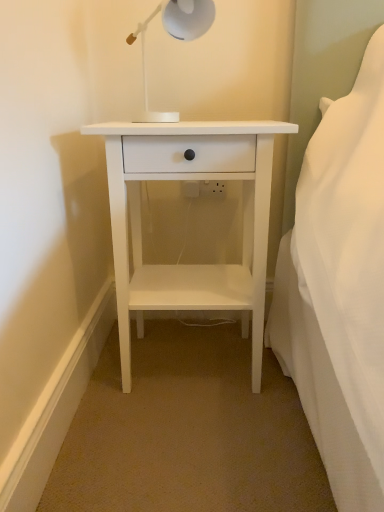
The height and width of the screenshot is (512, 384). What are the coordinates of `white matte nightstand at center` in the screenshot? It's located at (190, 182).

Describe the element at coordinates (190, 182) in the screenshot. The width and height of the screenshot is (384, 512). I see `white matte nightstand at center` at that location.

Measure the distance between white plastic lamp at upper center and camera.

white plastic lamp at upper center is 38.52 inches from camera.

Image resolution: width=384 pixels, height=512 pixels. Describe the element at coordinates (175, 38) in the screenshot. I see `white plastic lamp at upper center` at that location.

The image size is (384, 512). What are the coordinates of `white plastic lamp at upper center` in the screenshot? It's located at (175, 38).

The width and height of the screenshot is (384, 512). In order to click on white matte nightstand at center in this screenshot , I will do `click(190, 182)`.

Is white plastic lamp at upper center to the left of white matte nightstand at center from the viewer's perspective?

Correct, you'll find white plastic lamp at upper center to the left of white matte nightstand at center.

Which is behind, white plastic lamp at upper center or white matte nightstand at center?

white matte nightstand at center is behind.

Does point (176, 119) come in front of point (189, 129)?

That is False.

From the image's perspective, which is below, white plastic lamp at upper center or white matte nightstand at center?

white matte nightstand at center appears lower in the image.

From a real-world perspective, which is physically below, white plastic lamp at upper center or white matte nightstand at center?

white matte nightstand at center is physically lower.

From the picture: Looking at their sizes, would you say white plastic lamp at upper center is wider or thinner than white matte nightstand at center?

Clearly, white plastic lamp at upper center has less width compared to white matte nightstand at center.

Who is shorter, white plastic lamp at upper center or white matte nightstand at center?

Standing shorter between the two is white plastic lamp at upper center.

Looking at this image, who is bigger, white plastic lamp at upper center or white matte nightstand at center?

white matte nightstand at center is bigger.

Is white matte nightstand at center inside white plastic lamp at upper center?

No, white matte nightstand at center is not surrounded by white plastic lamp at upper center.

Are white plastic lamp at upper center and white matte nightstand at center making contact?

No.

Does white plastic lamp at upper center turn towards white matte nightstand at center?

No.

How many degrees apart are the facing directions of white plastic lamp at upper center and white matte nightstand at center?

white plastic lamp at upper center and white matte nightstand at center are facing 0.000616 degrees away from each other.

Where is `lamp above the white matte nightstand at center (from the image's perspective)`? This screenshot has width=384, height=512. lamp above the white matte nightstand at center (from the image's perspective) is located at coordinates (175, 38).

Considering the relative positions of white matte nightstand at center and white plastic lamp at upper center in the image provided, is white matte nightstand at center to the right of white plastic lamp at upper center from the viewer's perspective?

Yes, white matte nightstand at center is to the right of white plastic lamp at upper center.

Which object is closer to the camera taking this photo, white matte nightstand at center or white plastic lamp at upper center?

white plastic lamp at upper center.

Is point (91, 131) behind point (143, 61)?

No, it is not.

From the image's perspective, is white matte nightstand at center located beneath white plastic lamp at upper center?

Yes.

From a real-world perspective, is white matte nightstand at center positioned above or below white plastic lamp at upper center?

In terms of real-world spatial position, white matte nightstand at center is below white plastic lamp at upper center.

Between white matte nightstand at center and white plastic lamp at upper center, which one has smaller width?

white plastic lamp at upper center.

Who is shorter, white matte nightstand at center or white plastic lamp at upper center?

white plastic lamp at upper center.

Between white matte nightstand at center and white plastic lamp at upper center, which one has larger size?

With larger size is white matte nightstand at center.

Is white matte nightstand at center surrounding white plastic lamp at upper center?

No, white plastic lamp at upper center is not a part of white matte nightstand at center.

Are white matte nightstand at center and white plastic lamp at upper center located far from each other?

white matte nightstand at center is actually quite close to white plastic lamp at upper center.

Is white plastic lamp at upper center at the back of white matte nightstand at center?

white matte nightstand at center does not have its back to white plastic lamp at upper center.

Based on the photo, how many degrees apart are the facing directions of white matte nightstand at center and white plastic lamp at upper center?

The angle between the facing direction of white matte nightstand at center and the facing direction of white plastic lamp at upper center is 0.000616 degrees.

How far apart are white matte nightstand at center and white plastic lamp at upper center?

white matte nightstand at center is 12.98 inches away from white plastic lamp at upper center.

Where is `lamp on the left of white matte nightstand at center`? lamp on the left of white matte nightstand at center is located at coordinates (175, 38).

This screenshot has width=384, height=512. Find the location of `lamp above the white matte nightstand at center (from the image's perspective)`. lamp above the white matte nightstand at center (from the image's perspective) is located at coordinates (175, 38).

Find the location of a particular element. This screenshot has height=512, width=384. nightstand below the white plastic lamp at upper center (from the image's perspective) is located at coordinates (190, 182).